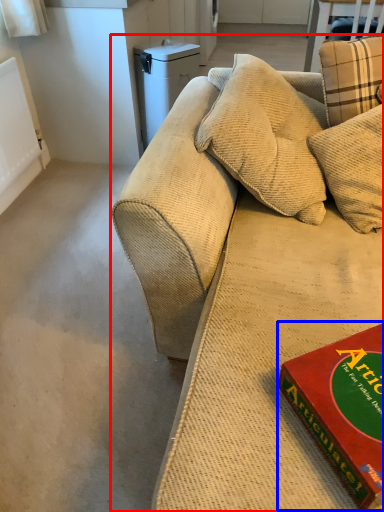
Question: Which of the following is the closest to the observer, studio couch (highlighted by a red box) or paperback book (highlighted by a blue box)?

Choices:
 (A) studio couch
 (B) paperback book

Answer: (B)